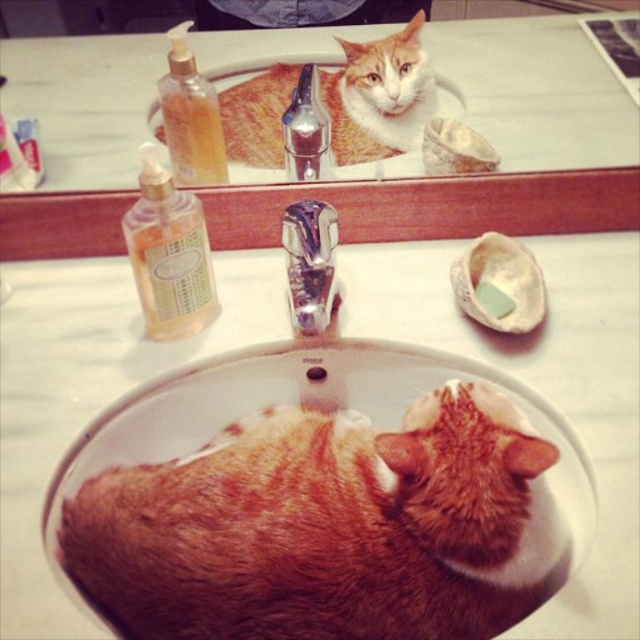
You are standing in the bathroom and want to place a small plant between the two points labeled point (419, 26) and point (490, 310). Which point should the plant be closer to so it is in front of the other point?

The plant should be closer to point (490, 310) because point (419, 26) is behind point (490, 310), so placing it near the front point ensures it is in front.

You are standing in the bathroom and see two points marked on the mirror above the sink. The first point is at coordinates point (211, 493) and the second is at point (316, 122). Which point is closer to you when you face the mirror?

Point (211, 493) is in front of point (316, 122), so when facing the mirror, point (211, 493) is closer to you.

You are trying to locate two specific points in the bathroom scene. The first point is at coordinates point (x=547, y=452) and the second is at point (x=307, y=246). From your perspective, which point is closer to you?

Point (x=547, y=452) is in front of point (x=307, y=246), so the first point is closer to you.